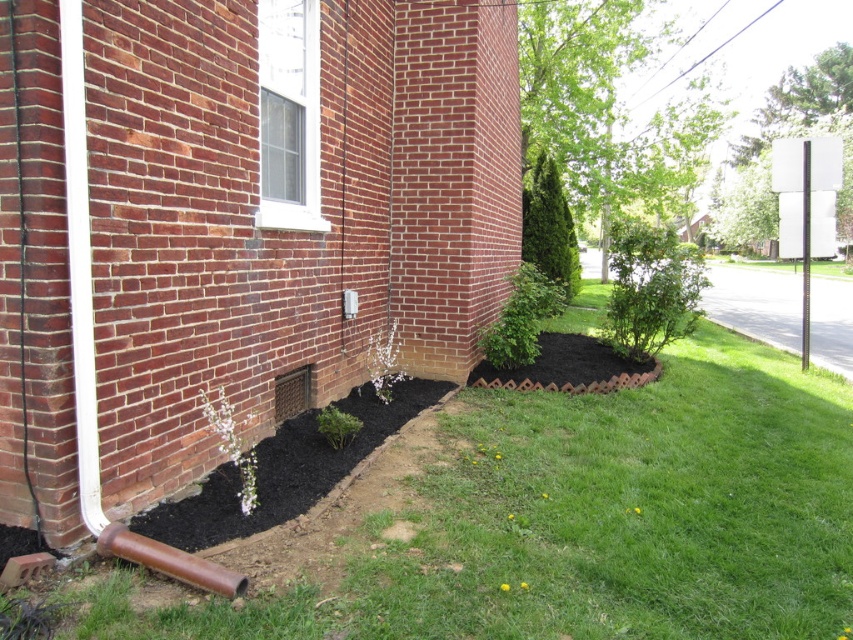
Question: Which object appears farthest from the camera in this image?

Choices:
 (A) black mulch at lower left
 (B) green grass at lower center

Answer: (B)

Question: Can you confirm if green grass at lower center is smaller than black mulch at lower left?

Choices:
 (A) yes
 (B) no

Answer: (A)

Question: Which point is closer to the camera taking this photo?

Choices:
 (A) (164, 605)
 (B) (364, 449)

Answer: (A)

Question: Which object is closer to the camera taking this photo?

Choices:
 (A) black mulch at lower left
 (B) green grass at lower center

Answer: (A)

Question: Does green grass at lower center appear on the left side of black mulch at lower left?

Choices:
 (A) yes
 (B) no

Answer: (B)

Question: Can you confirm if green grass at lower center is positioned above black mulch at lower left?

Choices:
 (A) yes
 (B) no

Answer: (A)